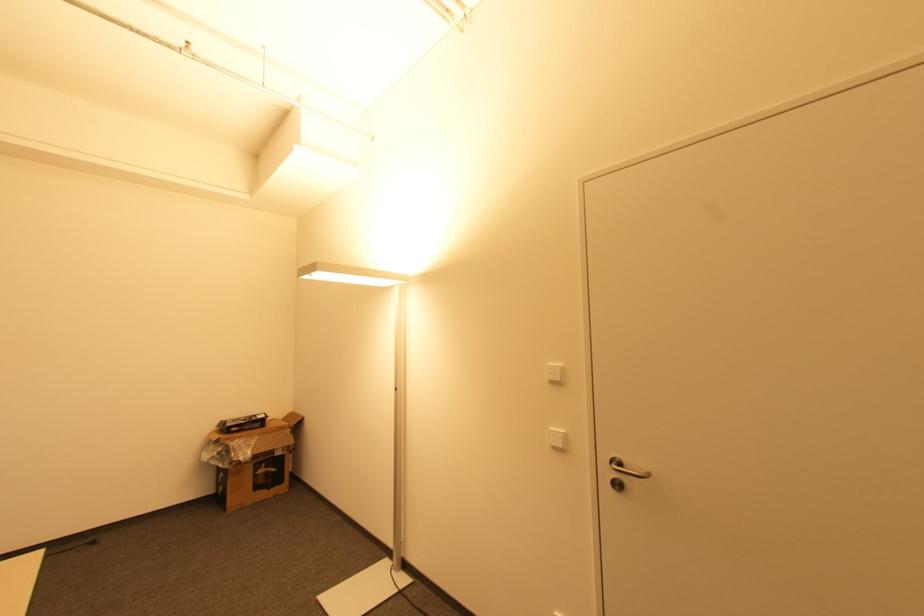
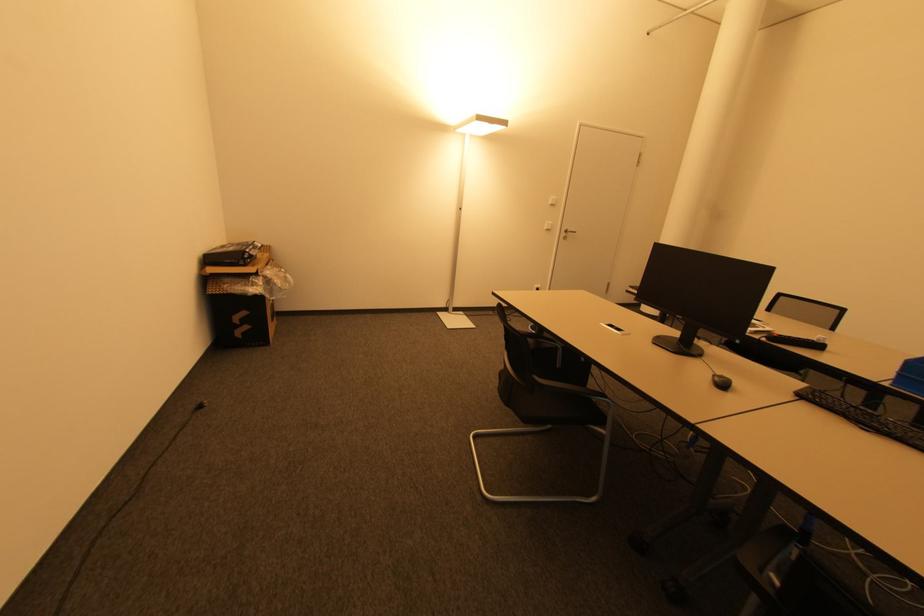
In the second image, find the point that corresponds to pixel 553 431 in the first image.

(550, 224)